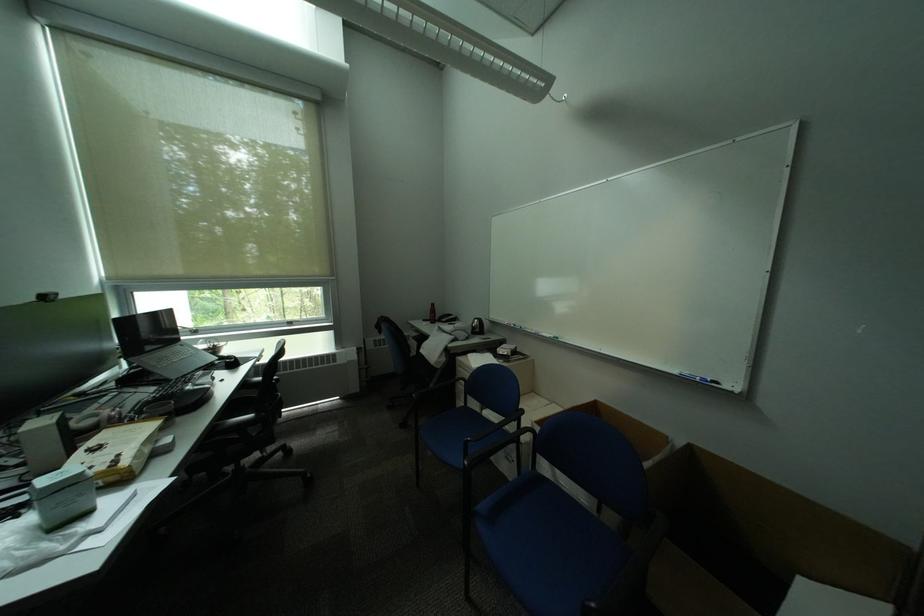
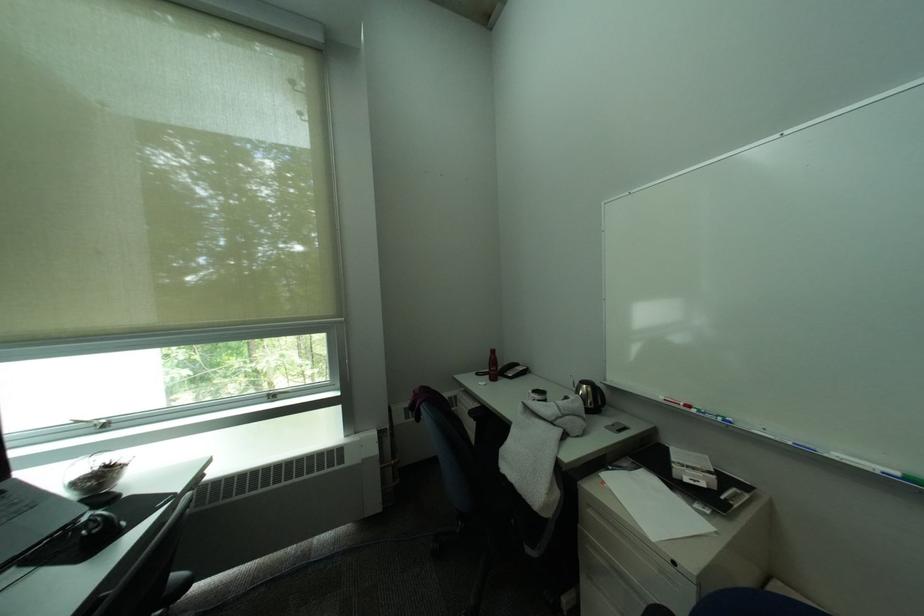
Where in the second image is the point corresponding to the point at 244,360 from the first image?

(106, 528)